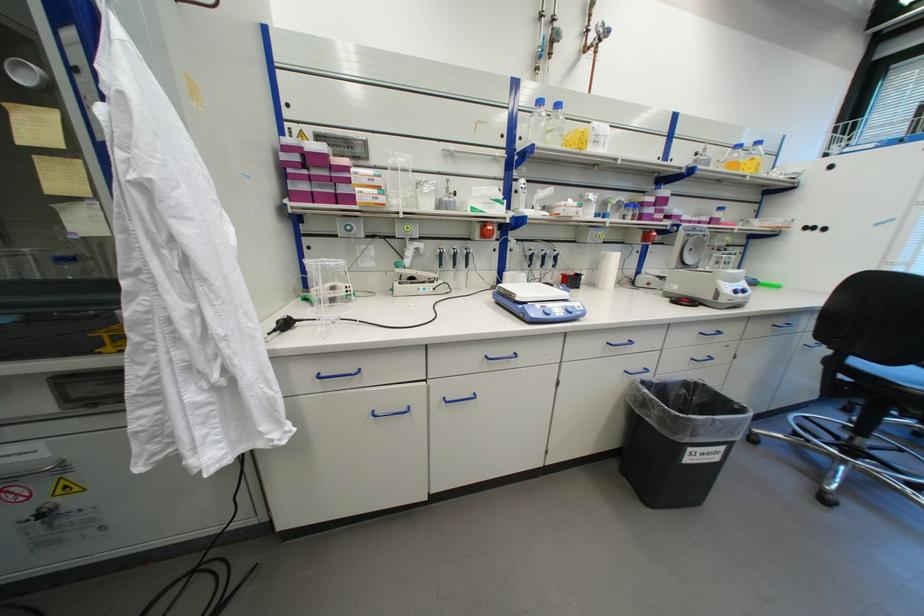
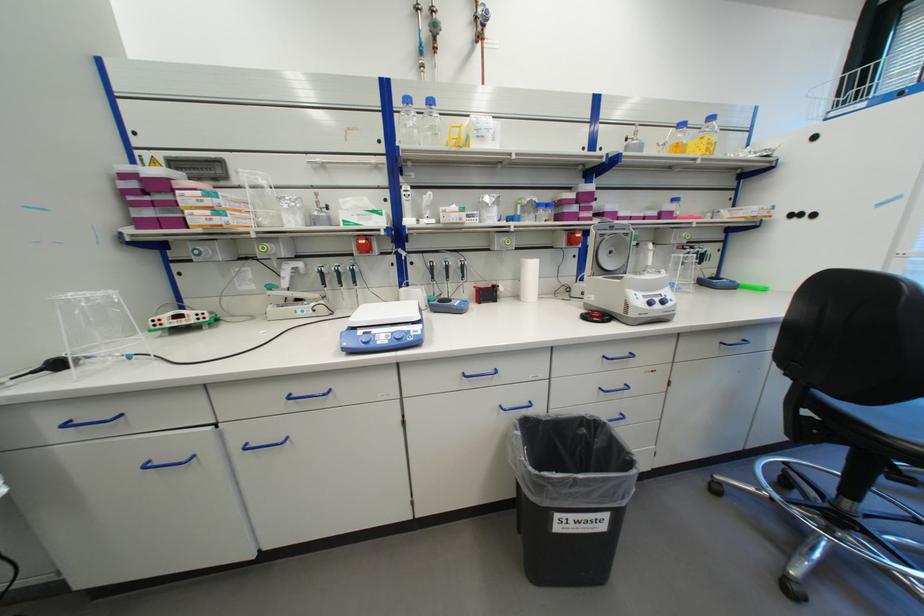
Find the pixel in the second image that matches point (660, 200) in the first image.

(579, 197)